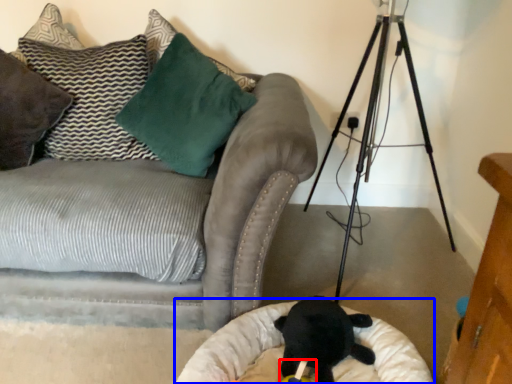
Question: Which object appears farthest to the camera in this image, toy (highlighted by a red box) or cat bed (highlighted by a blue box)?

Choices:
 (A) toy
 (B) cat bed

Answer: (A)